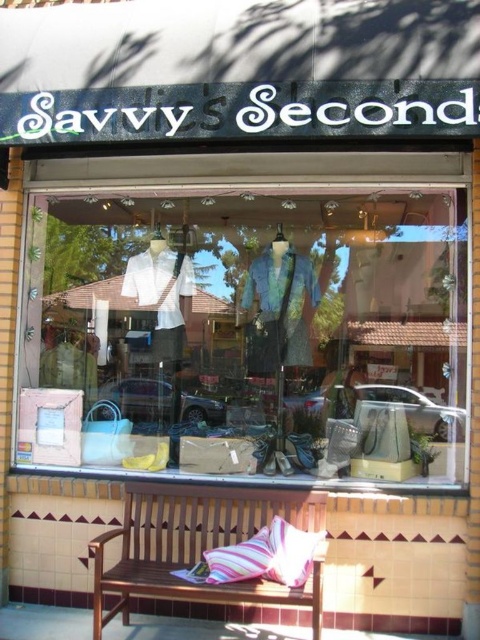
Question: Is brown wooden bench at center thinner than striped fabric pillow at center?

Choices:
 (A) no
 (B) yes

Answer: (A)

Question: Based on their relative distances, which object is farther from the matte glass display at center?

Choices:
 (A) brown wooden bench at center
 (B) striped fabric pillow at center
 (C) pink striped pillow at lower center

Answer: (C)

Question: Does matte glass display at center have a lesser width compared to striped fabric pillow at center?

Choices:
 (A) no
 (B) yes

Answer: (A)

Question: Which object is positioned closest to the striped fabric pillow at center?

Choices:
 (A) pink striped pillow at lower center
 (B) matte glass display at center
 (C) brown wooden bench at center

Answer: (A)

Question: Is the position of matte glass display at center less distant than that of brown wooden bench at center?

Choices:
 (A) yes
 (B) no

Answer: (B)

Question: Which point is farther to the camera?

Choices:
 (A) pink striped pillow at lower center
 (B) striped fabric pillow at center
 (C) matte glass display at center

Answer: (C)